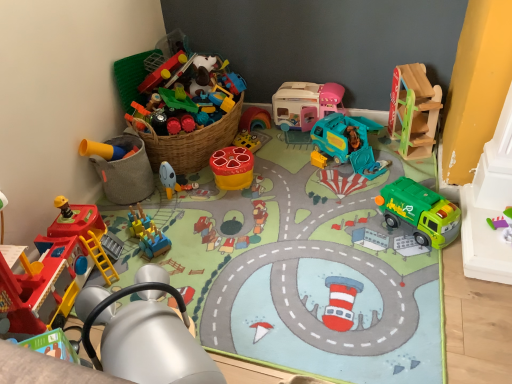
Image resolution: width=512 pixels, height=384 pixels. I want to click on free area below wooden slide at upper right, marked as the ninth toy in a left-to-right arrangement (from a real-world perspective), so click(x=413, y=152).